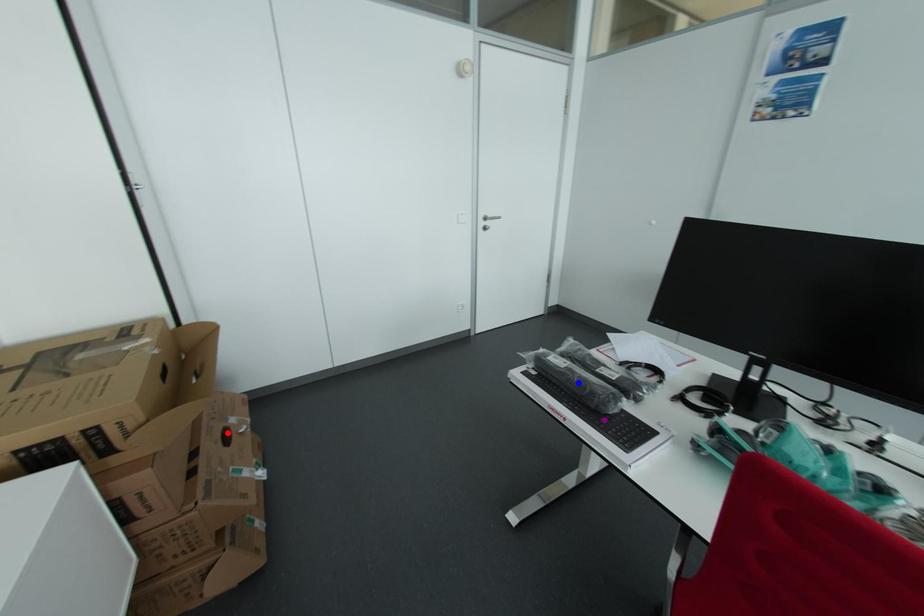
Order these from nearest to farthest:
red point, blue point, purple point

purple point → blue point → red point